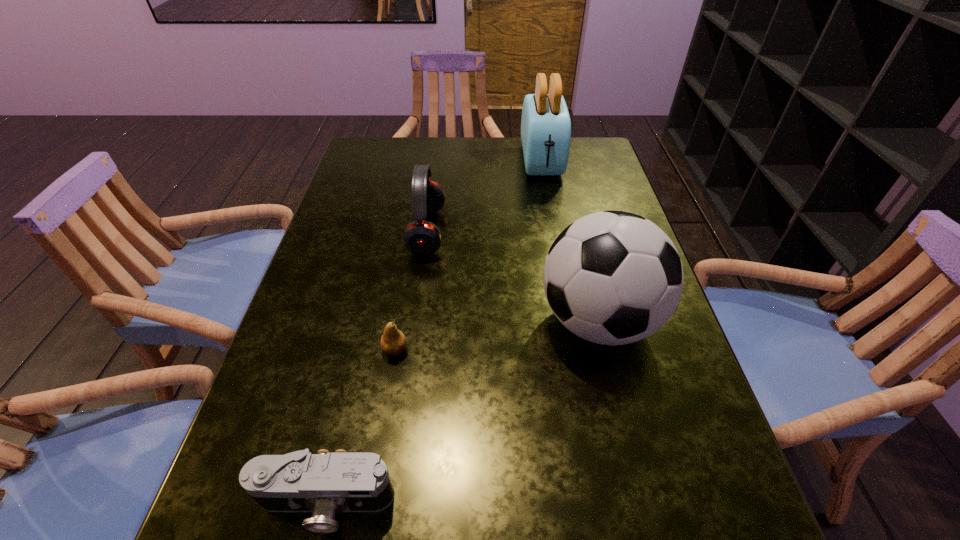
Image resolution: width=960 pixels, height=540 pixels. In order to click on object at the far edge in this screenshot , I will do `click(545, 125)`.

You are a GUI agent. You are given a task and a screenshot of the screen. Output one action in this format:
    pyautogui.click(x=<x>, y=<y>)
    Task: Click on the object that is at the left edge
    
    Given the screenshot: What is the action you would take?
    pyautogui.click(x=326, y=483)

Image resolution: width=960 pixels, height=540 pixels. I want to click on toaster situated at the right edge, so click(545, 125).

Locate an element on the screen. The height and width of the screenshot is (540, 960). soccer ball that is positioned at the right edge is located at coordinates (613, 277).

Locate an element on the screen. This screenshot has height=540, width=960. object present at the far right corner is located at coordinates (545, 125).

In order to click on vacant space at the far edge of the desktop in this screenshot , I will do `click(508, 174)`.

Where is `free space at the left edge of the desktop`? This screenshot has width=960, height=540. free space at the left edge of the desktop is located at coordinates (396, 209).

This screenshot has height=540, width=960. In the image, there is a desktop. Find the location of `vacant space at the right edge`. vacant space at the right edge is located at coordinates (589, 180).

The image size is (960, 540). Find the location of `blank space at the far left corner`. blank space at the far left corner is located at coordinates (396, 163).

The height and width of the screenshot is (540, 960). I want to click on vacant region at the far right corner of the desktop, so (591, 152).